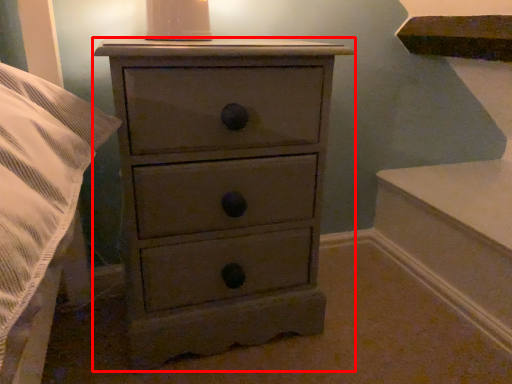
Question: From the image's perspective, what is the correct spatial positioning of chest of drawers (annotated by the red box) in reference to candle holder?

Choices:
 (A) below
 (B) above

Answer: (A)